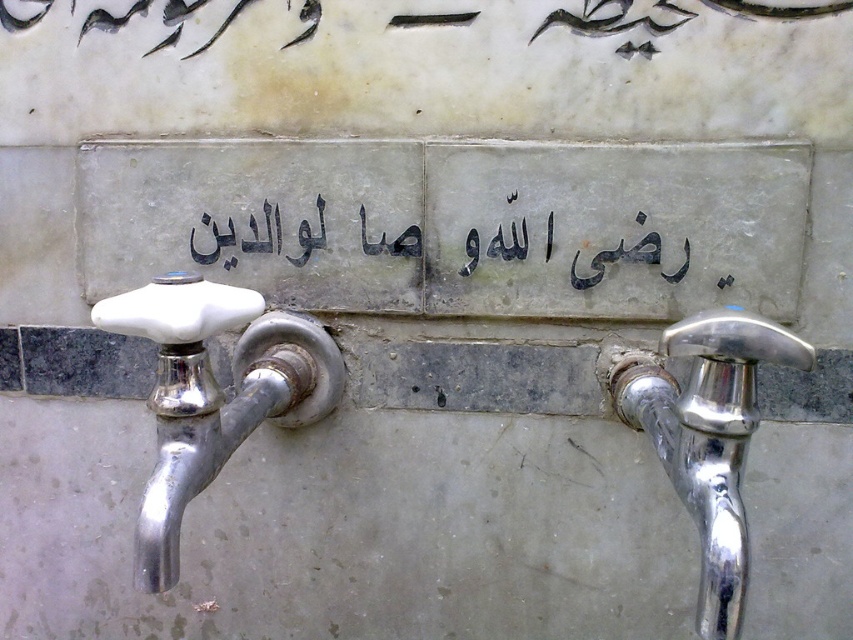
Is point (773, 348) positioned behind point (521, 256)?

No, it is not.

Which is behind, point (717, 577) or point (688, 262)?

The point (688, 262) is behind.

Between point (814, 356) and point (209, 218), which one is positioned in front?

Positioned in front is point (814, 356).

Where is `polished chrome faucet at right`? This screenshot has height=640, width=853. polished chrome faucet at right is located at coordinates (708, 436).

Who is positioned more to the right, white porcelain faucet at left or polished chrome faucet at right?

polished chrome faucet at right

Is white porcelain faucet at left below polished chrome faucet at right?

Actually, white porcelain faucet at left is above polished chrome faucet at right.

Is point (196, 321) positioned before point (643, 419)?

Yes, it is in front of point (643, 419).

The image size is (853, 640). I want to click on white porcelain faucet at left, so click(213, 394).

Is white porcelain faucet at left smaller than black stone writing at center?

Incorrect, white porcelain faucet at left is not smaller in size than black stone writing at center.

Is point (277, 316) in front of point (207, 218)?

That is True.

Find the location of `white porcelain faucet at left`. white porcelain faucet at left is located at coordinates (213, 394).